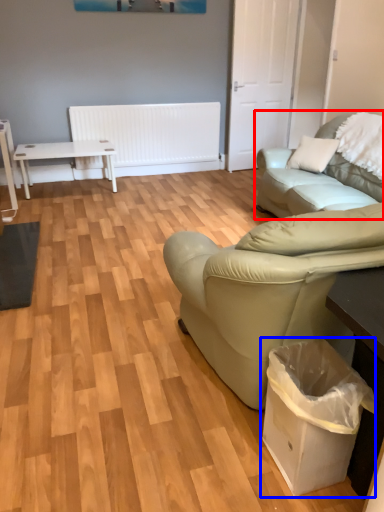
Question: Which point is further to the camera, studio couch (highlighted by a red box) or garbage (highlighted by a blue box)?

Choices:
 (A) studio couch
 (B) garbage

Answer: (A)